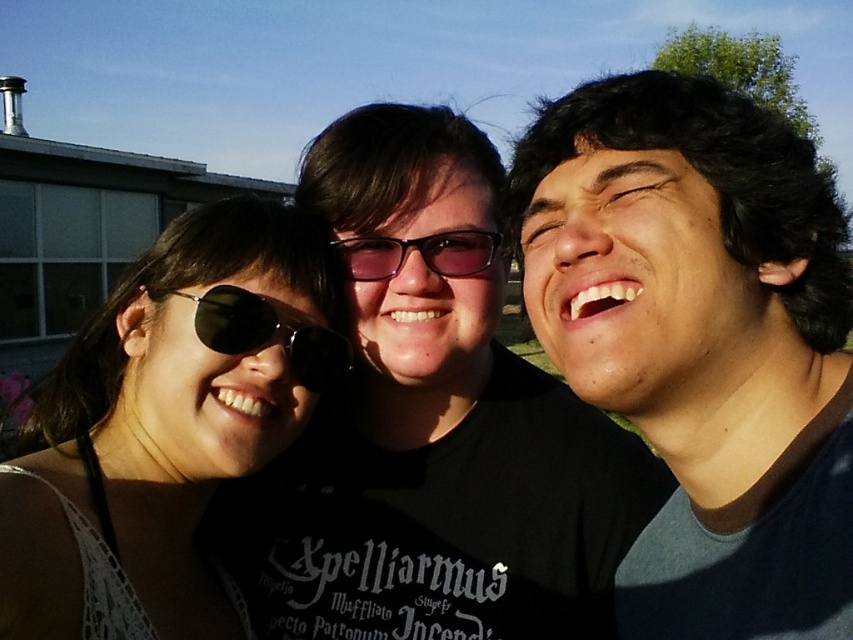
You are trying to determine which pair of sunglasses is wider between the sunglasses at left and the black reflective sunglasses at center. Based on the scene, which one has a greater width?

The sunglasses at left has a greater width than the black reflective sunglasses at center.

Based on the photo, you are standing at the origin of the coordinate system. You see a sunglasses at left located at point (165, 426). If you want to walk directly towards the sunglasses at left, in which direction should you move?

You should move towards the northeast direction since the sunglasses at left is located at point (165, 426), which is northeast of the origin.

You are standing 30 inches away from a dark brown hair at upper right. Can you safely step forward to get closer without exceeding the recommended social distance of 6 feet?

The dark brown hair at upper right is currently 31.92 inches away from the viewer. Since 31.92 inches is approximately 2.66 feet, stepping forward to get closer would exceed the recommended social distance of 6 feet. Therefore, you should not step forward.